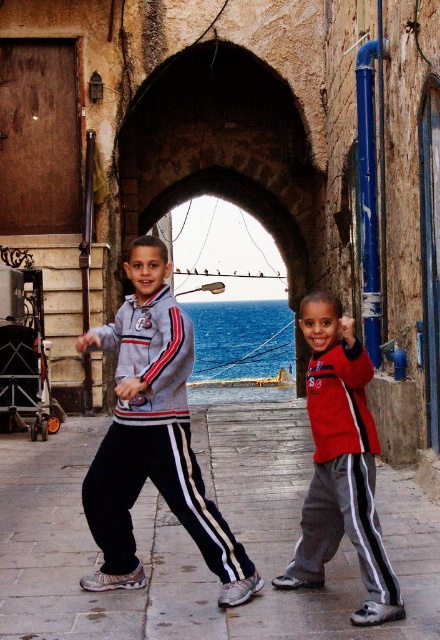
Can you confirm if black track pants at center is positioned to the left of matte gray sweatshirt at left?

In fact, black track pants at center is to the right of matte gray sweatshirt at left.

Can you confirm if black track pants at center is shorter than matte gray sweatshirt at left?

Correct, black track pants at center is not as tall as matte gray sweatshirt at left.

What are the coordinates of `black track pants at center` in the screenshot? It's located at (194, 545).

This screenshot has height=640, width=440. I want to click on gray track suit at center, so pos(153,436).

Can you confirm if gray track suit at center is bigger than matte gray sweatshirt at left?

Yes, gray track suit at center is bigger than matte gray sweatshirt at left.

This screenshot has width=440, height=640. What do you see at coordinates (153, 436) in the screenshot?
I see `gray track suit at center` at bounding box center [153, 436].

At what (x,y) coordinates should I click in order to perform the action: click on gray track suit at center. Please return your answer as a coordinate pair (x, y). The width and height of the screenshot is (440, 640). Looking at the image, I should click on (153, 436).

Is point (252, 544) positioned in front of point (134, 140)?

Yes, it is in front of point (134, 140).

Does black track pants at center have a lesser height compared to stone archway at center?

Correct, black track pants at center is not as tall as stone archway at center.

Between point (245, 627) and point (260, 218), which one is positioned behind?

Positioned behind is point (260, 218).

Where is `black track pants at center`? The height and width of the screenshot is (640, 440). black track pants at center is located at coordinates (194, 545).